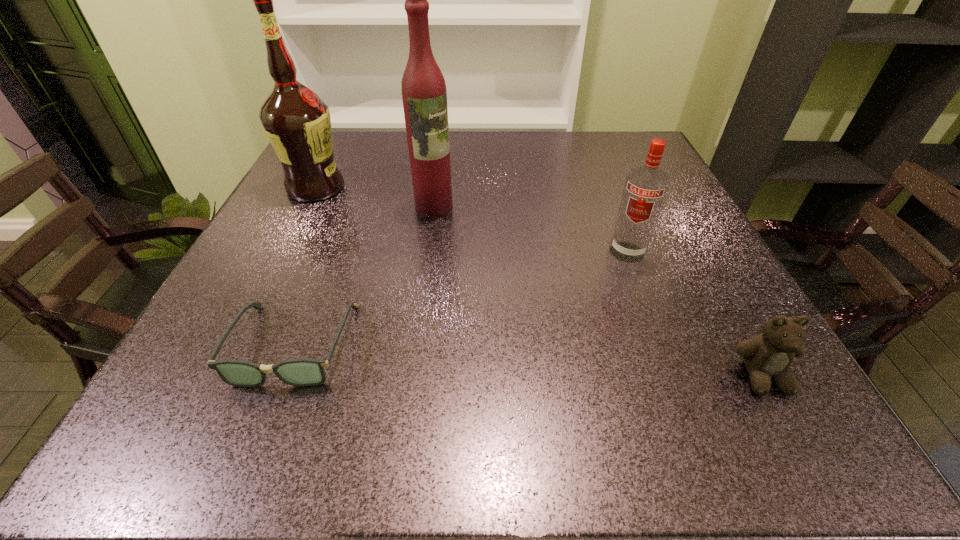
Identify the location of unoccupied position between the alcohol and the vodka. (471, 220).

The width and height of the screenshot is (960, 540). I want to click on free space between the vodka and the alcohol, so click(x=471, y=220).

At what (x,y) coordinates should I click in order to perform the action: click on vacant point located between the alcohol and the second object from right to left. Please return your answer as a coordinate pair (x, y). This screenshot has width=960, height=540. Looking at the image, I should click on (471, 220).

The height and width of the screenshot is (540, 960). Find the location of `the closest object to the fourth tallest object`. the closest object to the fourth tallest object is located at coordinates (645, 189).

Identify which object is the closest to the alcohol. Please provide its 2D coordinates. Your answer should be formatted as a tuple, i.e. [(x, y)], where the tuple contains the x and y coordinates of a point satisfying the conditions above.

[(424, 94)]